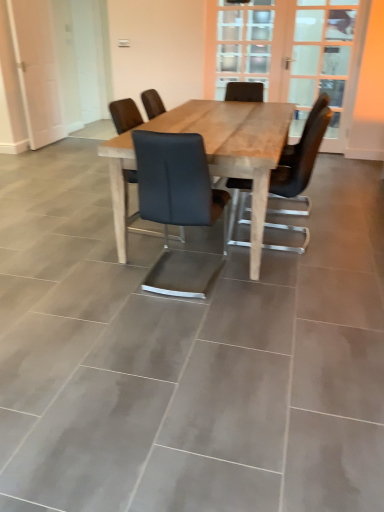
Image resolution: width=384 pixels, height=512 pixels. What are the coordinates of `free point above natural wood table at center (from a real-world perspective)` in the screenshot? It's located at pyautogui.click(x=227, y=118).